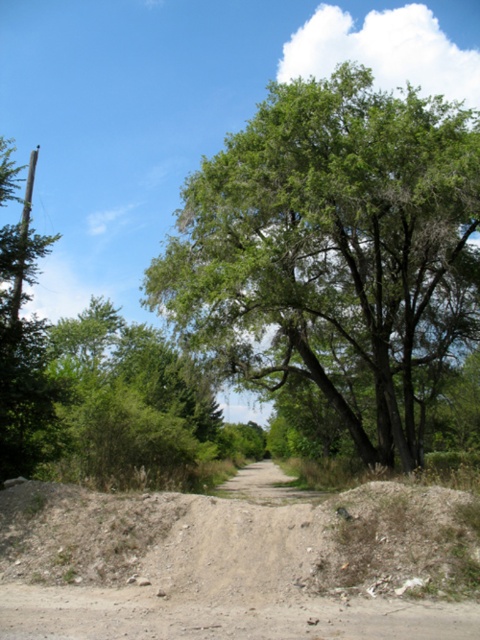
Can you confirm if brown gravel dirt track at center is wider than green leafy tree at left?

No, brown gravel dirt track at center is not wider than green leafy tree at left.

Can you confirm if brown gravel dirt track at center is bigger than green leafy tree at left?

Incorrect, brown gravel dirt track at center is not larger than green leafy tree at left.

Between point (364, 518) and point (38, 432), which one is positioned in front?

Positioned in front is point (364, 518).

This screenshot has width=480, height=640. Identify the location of brown gravel dirt track at center. (237, 561).

Which is above, green leafy tree at center or brown gravel dirt track at center?

Positioned higher is green leafy tree at center.

In order to click on green leafy tree at center in this screenshot , I will do `click(332, 252)`.

Can you confirm if green leafy tree at center is positioned above green leafy tree at left?

Correct, green leafy tree at center is located above green leafy tree at left.

Does point (424, 161) come closer to viewer compared to point (14, 396)?

No, (424, 161) is behind (14, 396).

This screenshot has width=480, height=640. What are the coordinates of `green leafy tree at center` in the screenshot? It's located at (332, 252).